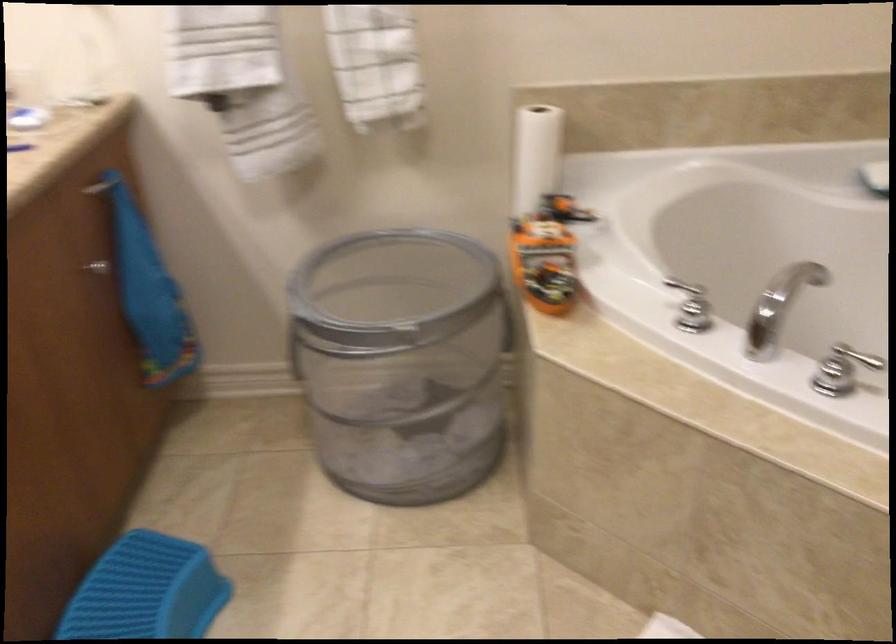
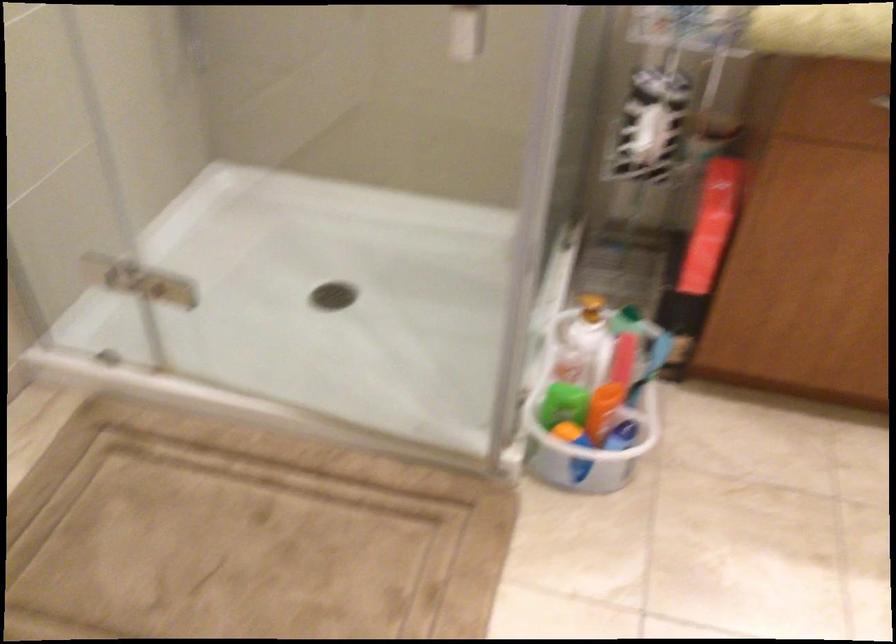
First-person continuous shooting, in which direction is the camera rotating?

The camera's rotation is toward left-down.